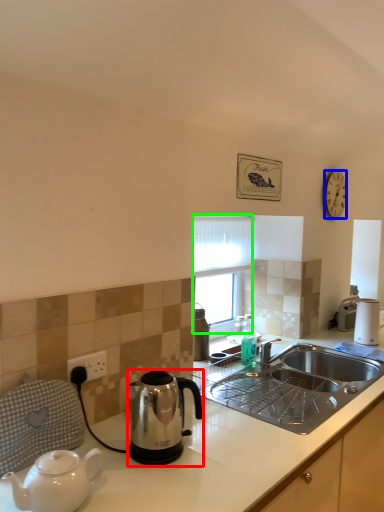
Question: Which object is positioned closest to kettle (highlighted by a red box)? Select from clock (highlighted by a blue box) and window screen (highlighted by a green box).

Choices:
 (A) clock
 (B) window screen

Answer: (B)